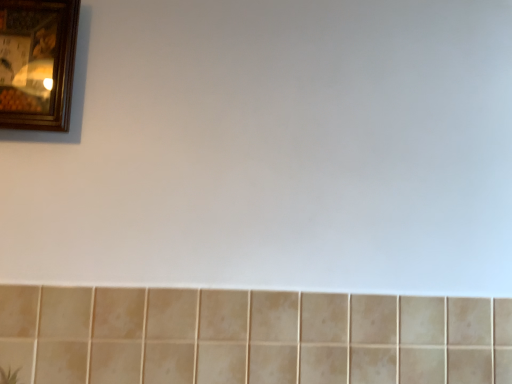
Question: In terms of height, does beige matte tile at lower center look taller or shorter compared to wooden picture frame at upper left?

Choices:
 (A) short
 (B) tall

Answer: (A)

Question: Do you think beige matte tile at lower center is within wooden picture frame at upper left, or outside of it?

Choices:
 (A) inside
 (B) outside

Answer: (B)

Question: From a real-world perspective, is beige matte tile at lower center positioned above or below wooden picture frame at upper left?

Choices:
 (A) above
 (B) below

Answer: (B)

Question: Considering the positions of wooden picture frame at upper left and beige matte tile at lower center in the image, is wooden picture frame at upper left taller or shorter than beige matte tile at lower center?

Choices:
 (A) tall
 (B) short

Answer: (A)

Question: Is point [x=0, y=92] closer or farther from the camera than point [x=232, y=321]?

Choices:
 (A) closer
 (B) farther

Answer: (B)

Question: Is wooden picture frame at upper left in front of or behind beige matte tile at lower center in the image?

Choices:
 (A) front
 (B) behind

Answer: (B)

Question: From the image's perspective, is wooden picture frame at upper left positioned above or below beige matte tile at lower center?

Choices:
 (A) above
 (B) below

Answer: (A)